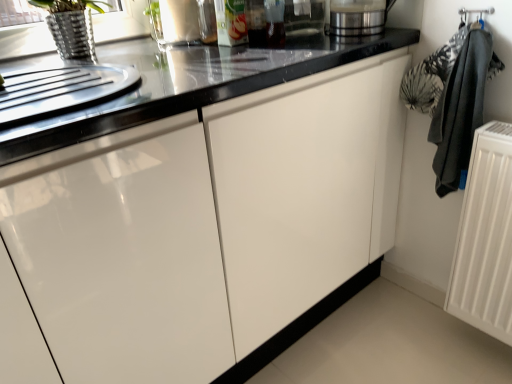
This screenshot has width=512, height=384. Find the location of `metallic glass at upper center, the 2th appliance in the right-to-left sequence`. metallic glass at upper center, the 2th appliance in the right-to-left sequence is located at coordinates (182, 21).

What do you see at coordinates (357, 17) in the screenshot?
I see `satin silver blender at upper right, the 1th appliance positioned from the right` at bounding box center [357, 17].

Where is `metallic glass at upper center, the 2th appliance in the right-to-left sequence`? The image size is (512, 384). metallic glass at upper center, the 2th appliance in the right-to-left sequence is located at coordinates (182, 21).

Which object is positioned more to the left, metallic glass at upper center, the 2th appliance in the right-to-left sequence, or black fabric laundry at right?

metallic glass at upper center, the 2th appliance in the right-to-left sequence, is more to the left.

Is metallic glass at upper center, the 1th appliance from the left, facing away from black fabric laundry at right?

metallic glass at upper center, the 1th appliance from the left, is not turned away from black fabric laundry at right.

Is point (191, 1) closer to camera compared to point (448, 108)?

That is False.

In the scene shown: Can you tell me how much black fabric laundry at right and satin silver blender at upper right, arranged as the second appliance when viewed from the left, differ in facing direction?

91 degrees.

Where is `laundry on the right of satin silver blender at upper right, arranged as the second appliance when viewed from the left`? The image size is (512, 384). laundry on the right of satin silver blender at upper right, arranged as the second appliance when viewed from the left is located at coordinates 452,99.

Is black fabric laundry at right thinner than satin silver blender at upper right, the 1th appliance positioned from the right?

Yes.

From the picture: From the image's perspective, between black fabric laundry at right and satin silver blender at upper right, arranged as the second appliance when viewed from the left, which one is located above?

From the image's view, satin silver blender at upper right, arranged as the second appliance when viewed from the left, is above.

From a real-world perspective, is black fabric laundry at right located beneath white matte radiator at right?

No, from a real-world perspective, black fabric laundry at right is not under white matte radiator at right.

Locate an element on the screen. laundry positioned vertically above the white matte radiator at right (from a real-world perspective) is located at coordinates (452, 99).

Considering the relative sizes of black fabric laundry at right and white matte radiator at right in the image provided, is black fabric laundry at right bigger than white matte radiator at right?

Correct, black fabric laundry at right is larger in size than white matte radiator at right.

Considering the sizes of objects satin silver blender at upper right, arranged as the second appliance when viewed from the left, and metallic glass at upper center, the 2th appliance in the right-to-left sequence, in the image provided, who is thinner, satin silver blender at upper right, arranged as the second appliance when viewed from the left, or metallic glass at upper center, the 2th appliance in the right-to-left sequence,?

metallic glass at upper center, the 2th appliance in the right-to-left sequence.

Between satin silver blender at upper right, the 1th appliance positioned from the right, and metallic glass at upper center, the 1th appliance from the left, which one has larger size?

metallic glass at upper center, the 1th appliance from the left, is bigger.

How much distance is there between satin silver blender at upper right, the 1th appliance positioned from the right, and metallic glass at upper center, the 2th appliance in the right-to-left sequence?

16.63 inches.

In the image, is satin silver blender at upper right, arranged as the second appliance when viewed from the left, positioned in front of or behind metallic glass at upper center, the 2th appliance in the right-to-left sequence?

In the image, satin silver blender at upper right, arranged as the second appliance when viewed from the left, appears in front of metallic glass at upper center, the 2th appliance in the right-to-left sequence.

Is satin silver blender at upper right, the 1th appliance positioned from the right, located outside white matte radiator at right?

satin silver blender at upper right, the 1th appliance positioned from the right, is positioned outside white matte radiator at right.

Is satin silver blender at upper right, arranged as the second appliance when viewed from the left, aimed at white matte radiator at right?

No, satin silver blender at upper right, arranged as the second appliance when viewed from the left, is not aimed at white matte radiator at right.

Is satin silver blender at upper right, arranged as the second appliance when viewed from the left, not near white matte radiator at right?

No, satin silver blender at upper right, arranged as the second appliance when viewed from the left, is not far away from white matte radiator at right.

Measure the distance from satin silver blender at upper right, arranged as the second appliance when viewed from the left, to white matte radiator at right.

satin silver blender at upper right, arranged as the second appliance when viewed from the left, is 23.53 inches away from white matte radiator at right.

Is white matte radiator at right not inside metallic glass at upper center, the 2th appliance in the right-to-left sequence?

white matte radiator at right lies outside metallic glass at upper center, the 2th appliance in the right-to-left sequence,'s area.

Which object is positioned more to the right, white matte radiator at right or metallic glass at upper center, the 2th appliance in the right-to-left sequence?

Positioned to the right is white matte radiator at right.

Is white matte radiator at right facing towards metallic glass at upper center, the 2th appliance in the right-to-left sequence?

No, white matte radiator at right is not aimed at metallic glass at upper center, the 2th appliance in the right-to-left sequence.

Considering the sizes of objects white matte radiator at right and metallic glass at upper center, the 1th appliance from the left, in the image provided, who is thinner, white matte radiator at right or metallic glass at upper center, the 1th appliance from the left,?

white matte radiator at right is thinner.

Are satin silver blender at upper right, the 1th appliance positioned from the right, and black fabric laundry at right far apart?

No, there isn't a large distance between satin silver blender at upper right, the 1th appliance positioned from the right, and black fabric laundry at right.

Is satin silver blender at upper right, arranged as the second appliance when viewed from the left, positioned behind black fabric laundry at right?

Yes.

From a real-world perspective, relative to black fabric laundry at right, is satin silver blender at upper right, the 1th appliance positioned from the right, vertically above or below?

In terms of real-world spatial position, satin silver blender at upper right, the 1th appliance positioned from the right, is above black fabric laundry at right.

Does satin silver blender at upper right, the 1th appliance positioned from the right, have a lesser width compared to black fabric laundry at right?

Incorrect, the width of satin silver blender at upper right, the 1th appliance positioned from the right, is not less than that of black fabric laundry at right.

Identify the location of laundry below the metallic glass at upper center, the 1th appliance from the left (from the image's perspective). (452, 99).

Locate an element on the screen. Image resolution: width=512 pixels, height=384 pixels. the 1st appliance behind when counting from the black fabric laundry at right is located at coordinates (357, 17).

Considering their positions, is satin silver blender at upper right, arranged as the second appliance when viewed from the left, positioned further to black fabric laundry at right than white matte radiator at right?

The object further to black fabric laundry at right is satin silver blender at upper right, arranged as the second appliance when viewed from the left.

Looking at this image, estimate the real-world distances between objects in this image. Which object is closer to white matte radiator at right, metallic glass at upper center, the 1th appliance from the left, or black fabric laundry at right?

Among the two, black fabric laundry at right is located nearer to white matte radiator at right.

Estimate the real-world distances between objects in this image. Which object is closer to satin silver blender at upper right, arranged as the second appliance when viewed from the left, metallic glass at upper center, the 1th appliance from the left, or white matte radiator at right?

metallic glass at upper center, the 1th appliance from the left, lies closer to satin silver blender at upper right, arranged as the second appliance when viewed from the left, than the other object.

Based on their spatial positions, is white matte radiator at right or black fabric laundry at right further from satin silver blender at upper right, arranged as the second appliance when viewed from the left?

Among the two, white matte radiator at right is located further to satin silver blender at upper right, arranged as the second appliance when viewed from the left.

Looking at the image, which one is located closer to white matte radiator at right, metallic glass at upper center, the 2th appliance in the right-to-left sequence, or satin silver blender at upper right, the 1th appliance positioned from the right?

satin silver blender at upper right, the 1th appliance positioned from the right, is closer to white matte radiator at right.

When comparing their distances from black fabric laundry at right, does satin silver blender at upper right, arranged as the second appliance when viewed from the left, or metallic glass at upper center, the 2th appliance in the right-to-left sequence, seem further?

metallic glass at upper center, the 2th appliance in the right-to-left sequence, is further to black fabric laundry at right.

When comparing their distances from white matte radiator at right, does satin silver blender at upper right, the 1th appliance positioned from the right, or black fabric laundry at right seem closer?

black fabric laundry at right is closer to white matte radiator at right.

When comparing their distances from metallic glass at upper center, the 1th appliance from the left, does satin silver blender at upper right, the 1th appliance positioned from the right, or white matte radiator at right seem closer?

Based on the image, satin silver blender at upper right, the 1th appliance positioned from the right, appears to be nearer to metallic glass at upper center, the 1th appliance from the left.

Identify the location of appliance between metallic glass at upper center, the 1th appliance from the left, and black fabric laundry at right. (357, 17).

The image size is (512, 384). What are the coordinates of `appliance situated between metallic glass at upper center, the 1th appliance from the left, and white matte radiator at right from left to right` in the screenshot? It's located at (357, 17).

I want to click on laundry that lies between satin silver blender at upper right, arranged as the second appliance when viewed from the left, and white matte radiator at right from top to bottom, so click(x=452, y=99).

Identify the location of laundry located between metallic glass at upper center, the 2th appliance in the right-to-left sequence, and white matte radiator at right in the left-right direction. (452, 99).